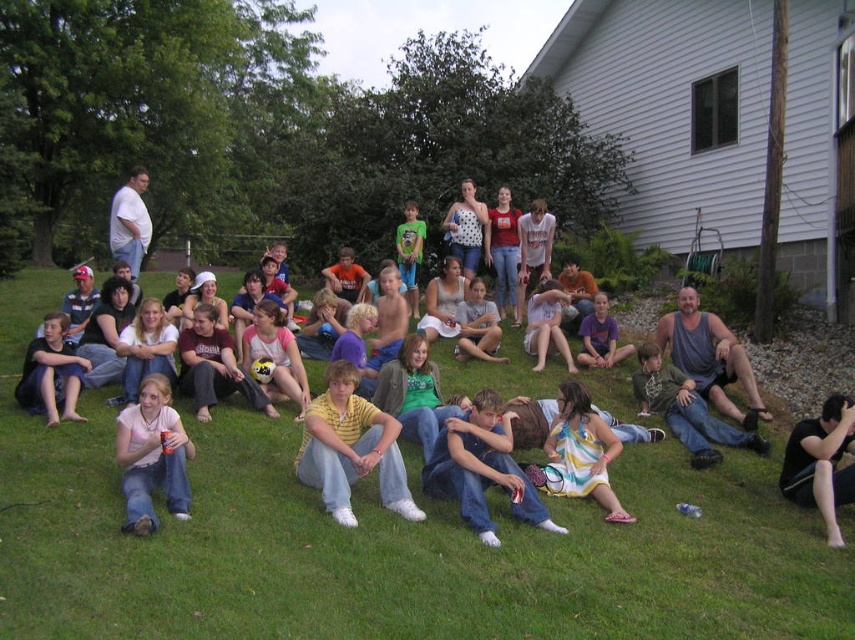
You are organizing a clothing donation drive and need to categorize the gray tank top at center and the light gray cotton shirt at center based on their sizes. Which one should be placed in the large size bin?

The gray tank top at center is larger in size than the light gray cotton shirt at center, so it should be placed in the large size bin.

You are a photographer trying to capture a candid shot of the black cotton shirt at lower right and the purple cotton shirt at center. Since you want to make sure both shirts are in focus, which one should you focus on first to ensure the other is also in focus?

The black cotton shirt at lower right is positioned under the purple cotton shirt at center. To ensure both are in focus, you should focus on the purple cotton shirt at center first, as it is closer to the camera, and the black cotton shirt at lower right being behind it will also be in focus due to depth of field.

You are standing at the center of the grassy lawn in front of the white house. You need to locate the black cotton shirt at lower right. Which direction should you look to find it?

The black cotton shirt at lower right is located at the lower right direction from your position at the center of the grassy lawn in front of the white house.